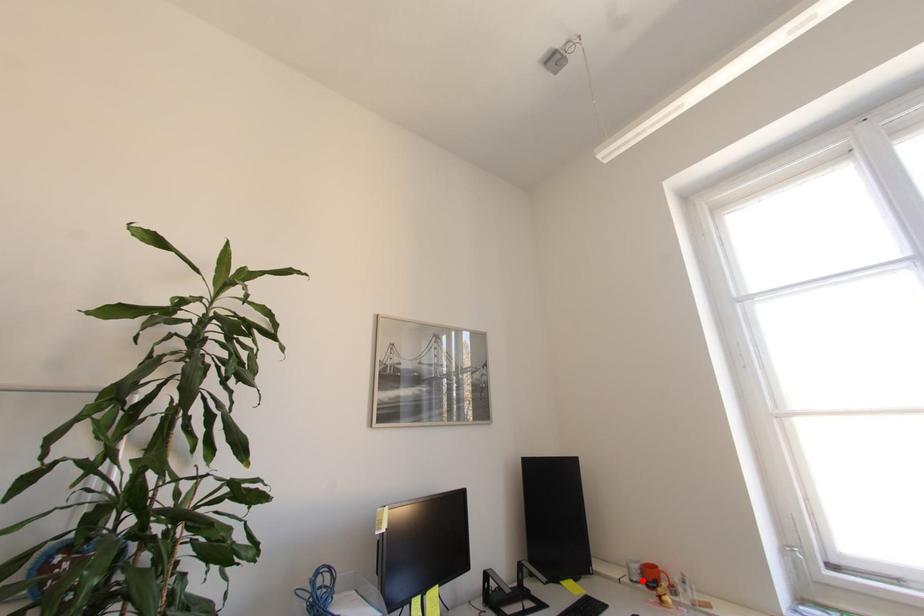
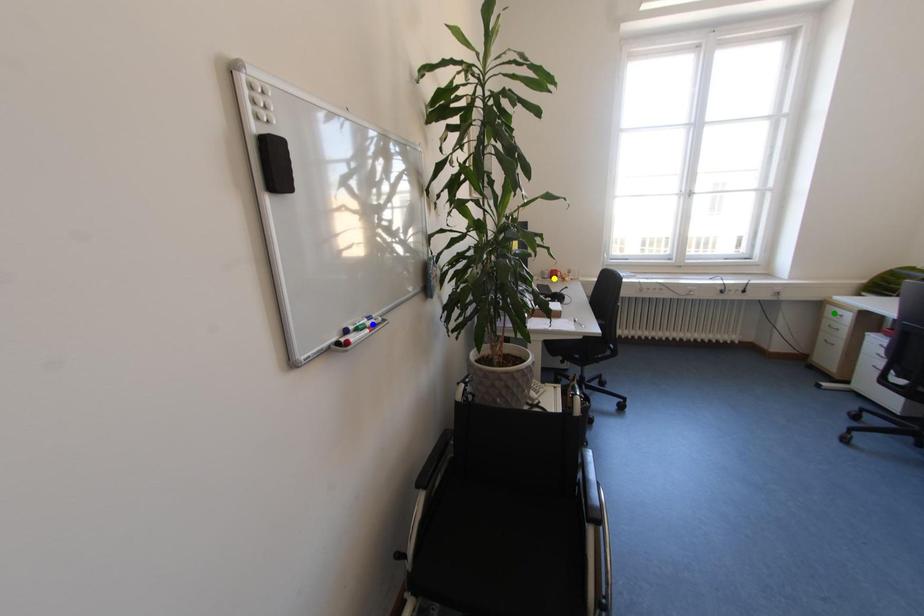
Question: I am providing you with two images of the same scene from different viewpoints. A red point is marked on the first image. You are given multiple points on the second image. Which point in image 2 represents the same 3d spot as the red point in image 1?

Choices:
 (A) green point
 (B) blue point
 (C) yellow point

Answer: (C)